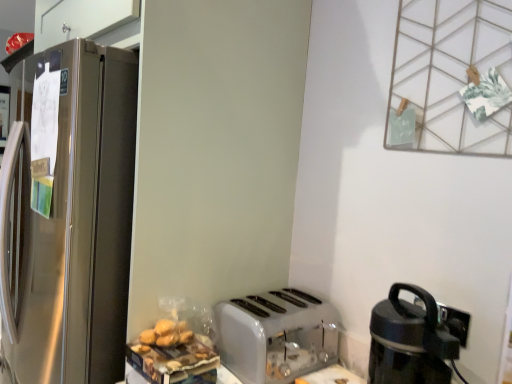
Question: Can you confirm if white plastic toaster at lower center is bigger than black plastic coffee maker at lower right?

Choices:
 (A) no
 (B) yes

Answer: (B)

Question: Is white plastic toaster at lower center taller than black plastic coffee maker at lower right?

Choices:
 (A) no
 (B) yes

Answer: (A)

Question: Considering the relative sizes of white plastic toaster at lower center and black plastic coffee maker at lower right in the image provided, is white plastic toaster at lower center thinner than black plastic coffee maker at lower right?

Choices:
 (A) yes
 (B) no

Answer: (B)

Question: From a real-world perspective, is white plastic toaster at lower center positioned under black plastic coffee maker at lower right based on gravity?

Choices:
 (A) no
 (B) yes

Answer: (B)

Question: Does white plastic toaster at lower center lie in front of black plastic coffee maker at lower right?

Choices:
 (A) yes
 (B) no

Answer: (B)

Question: Can you confirm if white plastic toaster at lower center is smaller than black plastic coffee maker at lower right?

Choices:
 (A) no
 (B) yes

Answer: (A)

Question: From the image's perspective, is black plastic coffee maker at lower right under white plastic toaster at lower center?

Choices:
 (A) no
 (B) yes

Answer: (A)

Question: Can you confirm if black plastic coffee maker at lower right is positioned to the left of white plastic toaster at lower center?

Choices:
 (A) no
 (B) yes

Answer: (A)

Question: Could you tell me if black plastic coffee maker at lower right is facing white plastic toaster at lower center?

Choices:
 (A) yes
 (B) no

Answer: (B)

Question: Does black plastic coffee maker at lower right have a greater width compared to white plastic toaster at lower center?

Choices:
 (A) yes
 (B) no

Answer: (B)

Question: Can you confirm if black plastic coffee maker at lower right is bigger than white plastic toaster at lower center?

Choices:
 (A) yes
 (B) no

Answer: (B)

Question: Does black plastic coffee maker at lower right appear on the right side of white plastic toaster at lower center?

Choices:
 (A) no
 (B) yes

Answer: (B)

Question: Is white plastic toaster at lower center bigger or smaller than black plastic coffee maker at lower right?

Choices:
 (A) small
 (B) big

Answer: (B)